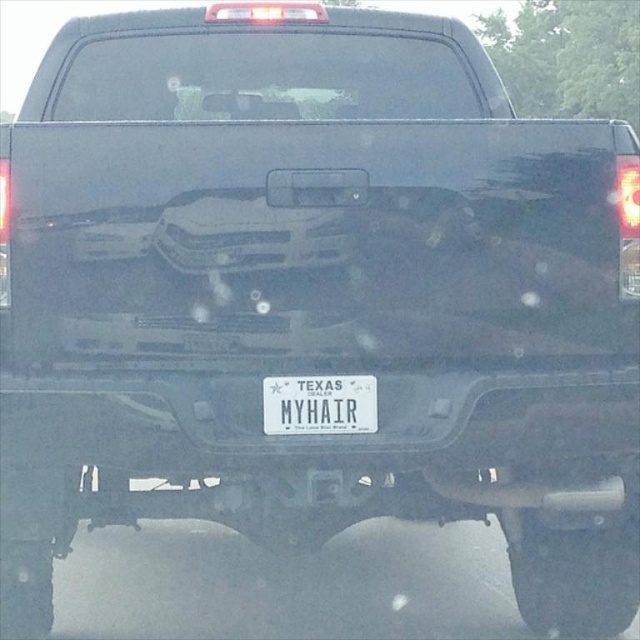
Does white plastic bumper at center appear over white plastic license plate at center?

Actually, white plastic bumper at center is below white plastic license plate at center.

Does white plastic bumper at center appear on the right side of white plastic license plate at center?

Yes, white plastic bumper at center is to the right of white plastic license plate at center.

This screenshot has width=640, height=640. What do you see at coordinates (321, 429) in the screenshot? I see `white plastic bumper at center` at bounding box center [321, 429].

This screenshot has width=640, height=640. Find the location of `white plastic bumper at center`. white plastic bumper at center is located at coordinates (321, 429).